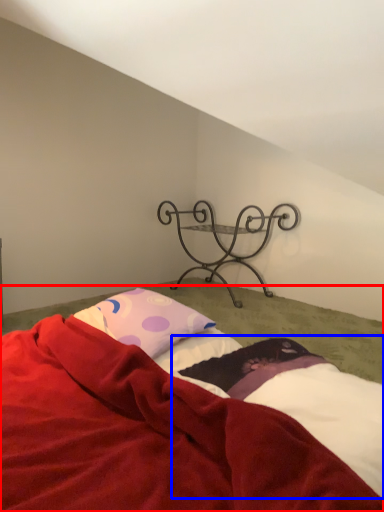
Question: Among these objects, which one is farthest to the camera, bed (highlighted by a red box) or sheet (highlighted by a blue box)?

Choices:
 (A) bed
 (B) sheet

Answer: (B)